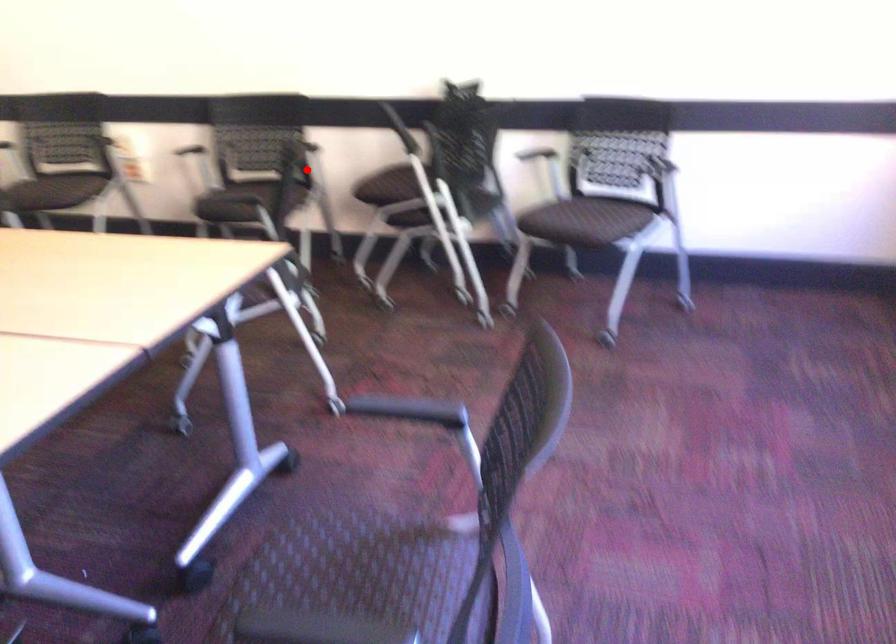
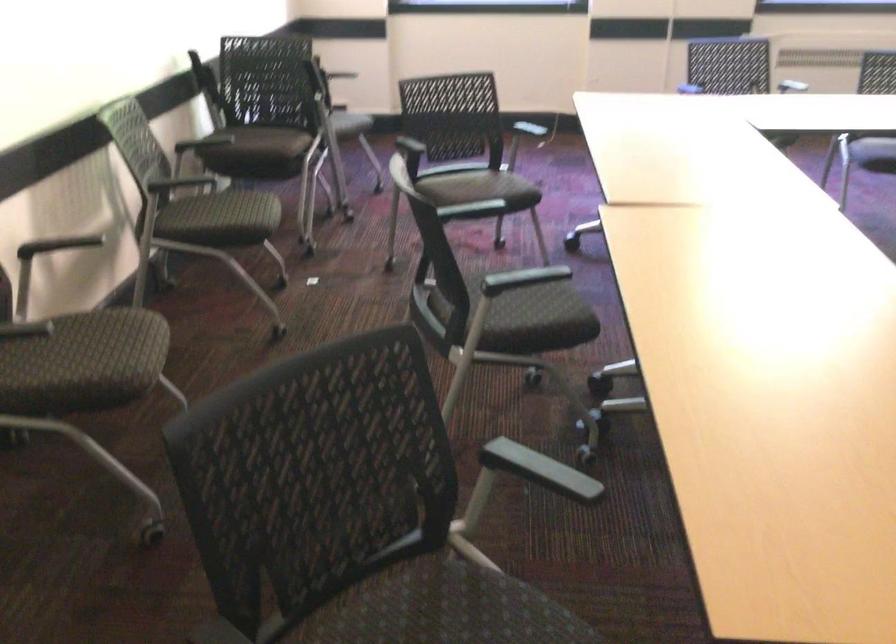
Locate, in the second image, the point that corresponds to the highlighted location in the first image.

(168, 187)